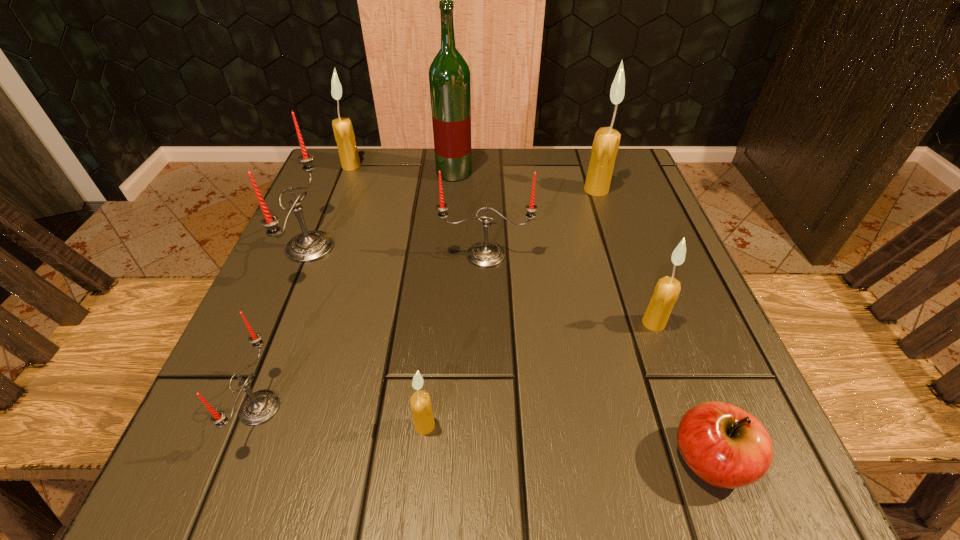
Locate an element on the screen. This screenshot has height=540, width=960. free point between the farthest cream candle and the second biggest red candle is located at coordinates (419, 211).

Locate an element on the screen. free point between the smallest cream candle and the farthest candle is located at coordinates (388, 295).

Find the location of a particular element. The width and height of the screenshot is (960, 540). unoccupied area between the farthest cream candle and the nearest red candle is located at coordinates (305, 287).

This screenshot has width=960, height=540. In order to click on free area in between the second biggest red candle and the nearest cream candle in this screenshot , I will do `click(456, 340)`.

This screenshot has width=960, height=540. I want to click on free spot between the smallest red candle and the third nearest cream candle, so click(x=428, y=299).

Identify the location of free spot between the biggest red candle and the tallest candle. The height and width of the screenshot is (540, 960). (453, 219).

This screenshot has height=540, width=960. Find the location of `free space between the second nearest cream candle and the biggest red candle`. free space between the second nearest cream candle and the biggest red candle is located at coordinates (482, 285).

Identify which object is located as the eighth nearest to the biggest red candle. Please provide its 2D coordinates. Your answer should be formatted as a tuple, i.e. [(x, y)], where the tuple contains the x and y coordinates of a point satisfying the conditions above.

[(727, 447)]

Find the location of a particular element. The width and height of the screenshot is (960, 540). object that is the sixth closest to the sixth nearest candle is located at coordinates (727, 447).

Select which candle appears as the second closest to the fourth nearest object. Please provide its 2D coordinates. Your answer should be formatted as a tuple, i.e. [(x, y)], where the tuple contains the x and y coordinates of a point satisfying the conditions above.

[(605, 146)]